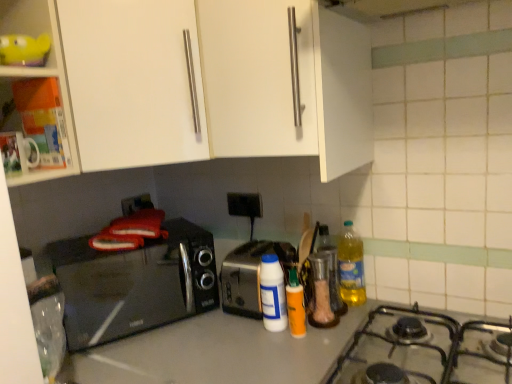
At what (x,y) coordinates should I click in order to perform the action: click on free spot in front of orange matte bottle at center, the second bottle from the right. Please return your answer as a coordinate pair (x, y). Looking at the image, I should click on (291, 356).